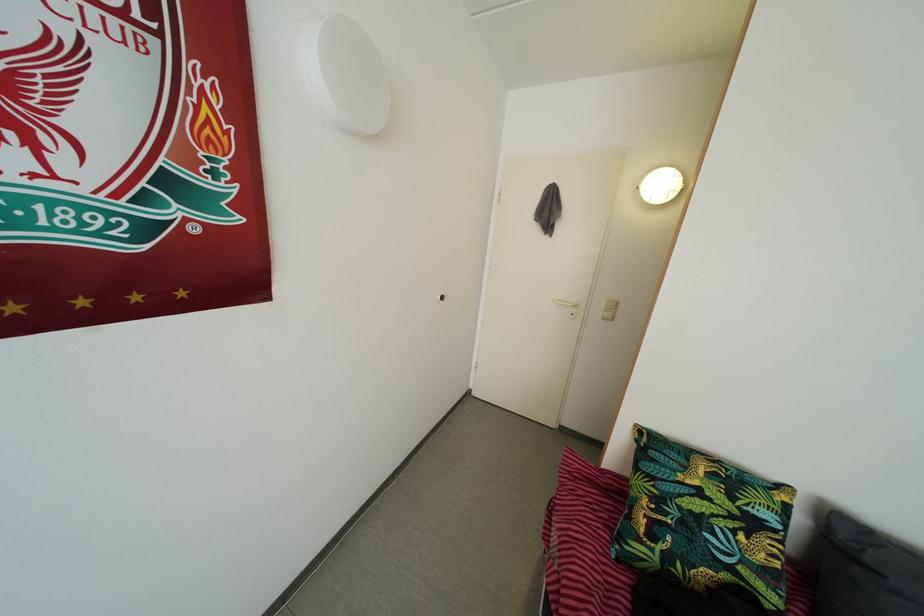
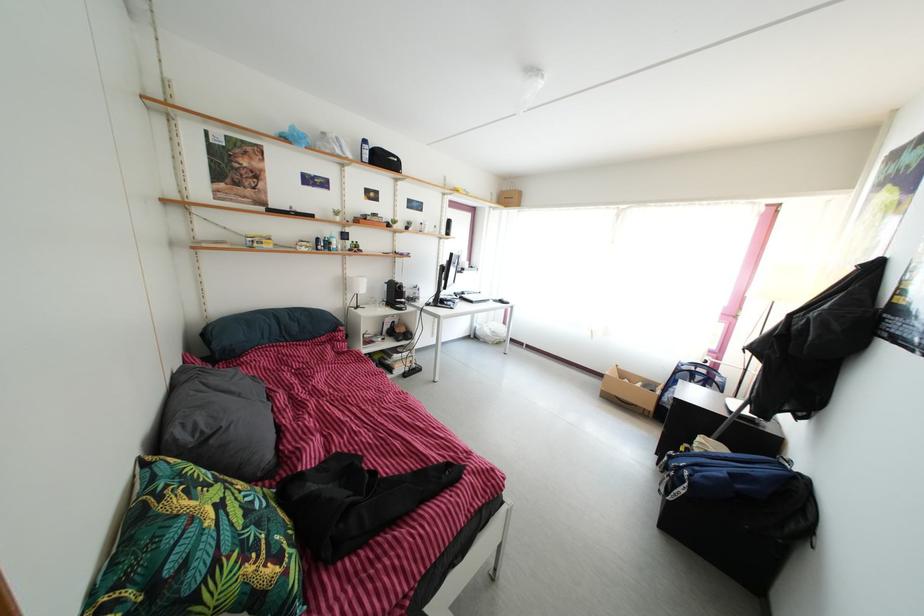
In the second image, find the point that corresponds to point 862,576 in the first image.

(217, 450)